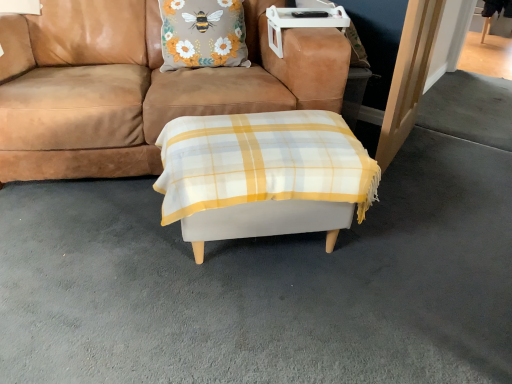
Where is `vacant space situated above white fabric ottoman at center (from a real-world perspective)`? vacant space situated above white fabric ottoman at center (from a real-world perspective) is located at coordinates (252, 135).